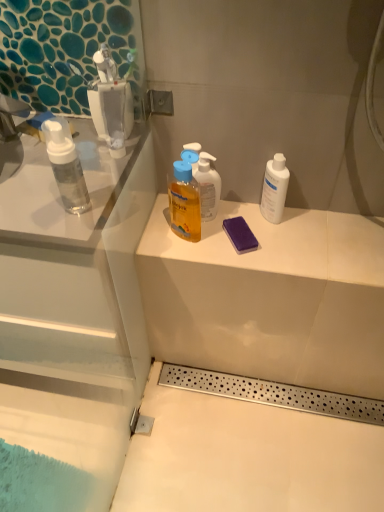
Image resolution: width=384 pixels, height=512 pixels. Find the location of `free point in front of white matte bottle at right`. free point in front of white matte bottle at right is located at coordinates (286, 252).